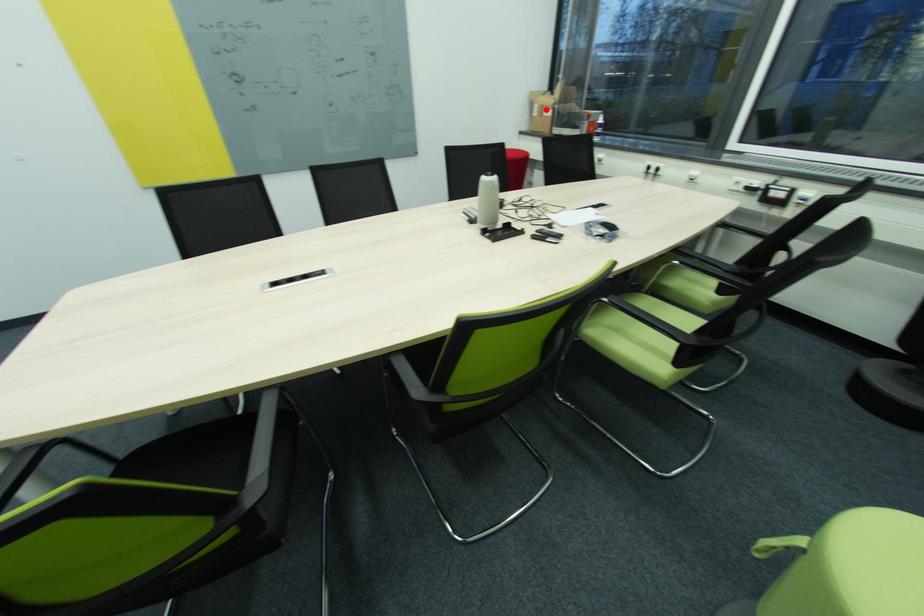
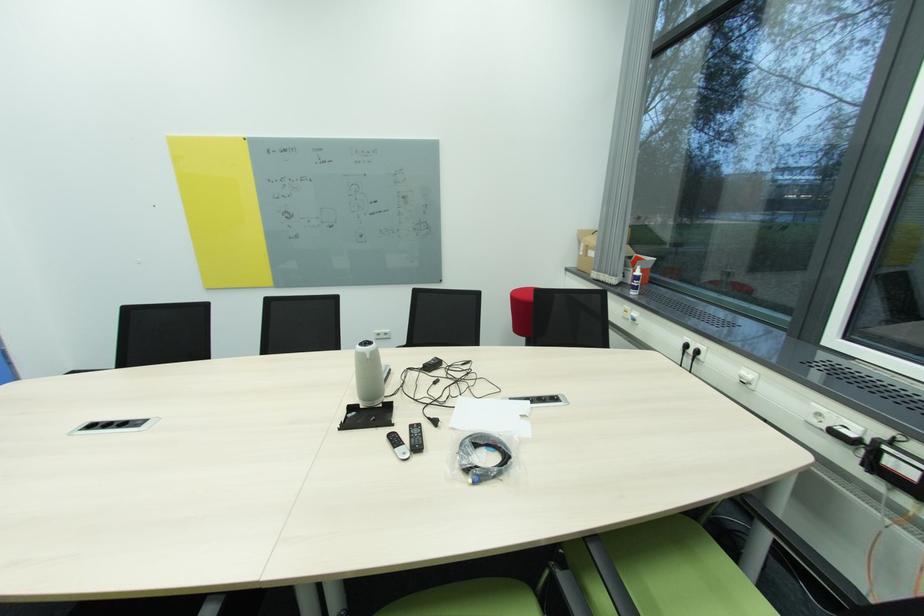
Locate, in the second image, the point that corresponds to the highlighted location in the first image.

(591, 249)